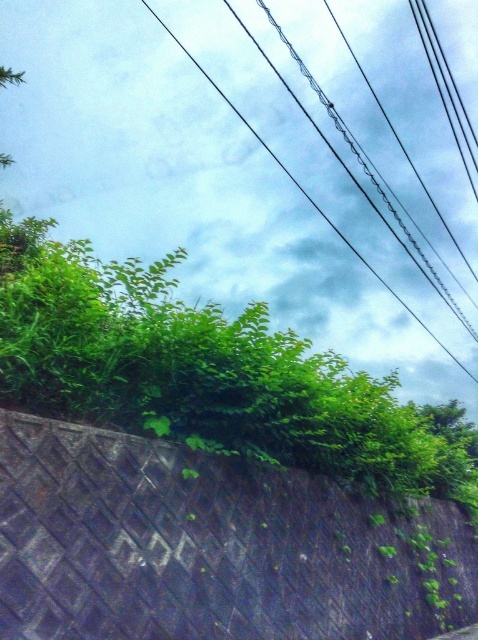
Question: Is dark gray textured ramp at lower left closer to camera compared to black wire at upper center?

Choices:
 (A) yes
 (B) no

Answer: (A)

Question: Is dark gray textured ramp at lower left positioned in front of black wire at upper center?

Choices:
 (A) no
 (B) yes

Answer: (B)

Question: Which of the following is the farthest from the observer?

Choices:
 (A) (184, 51)
 (B) (210, 589)

Answer: (A)

Question: Which point is closer to the camera?

Choices:
 (A) dark gray textured ramp at lower left
 (B) black wire at upper center

Answer: (A)

Question: Is dark gray textured ramp at lower left closer to camera compared to black wire at upper center?

Choices:
 (A) yes
 (B) no

Answer: (A)